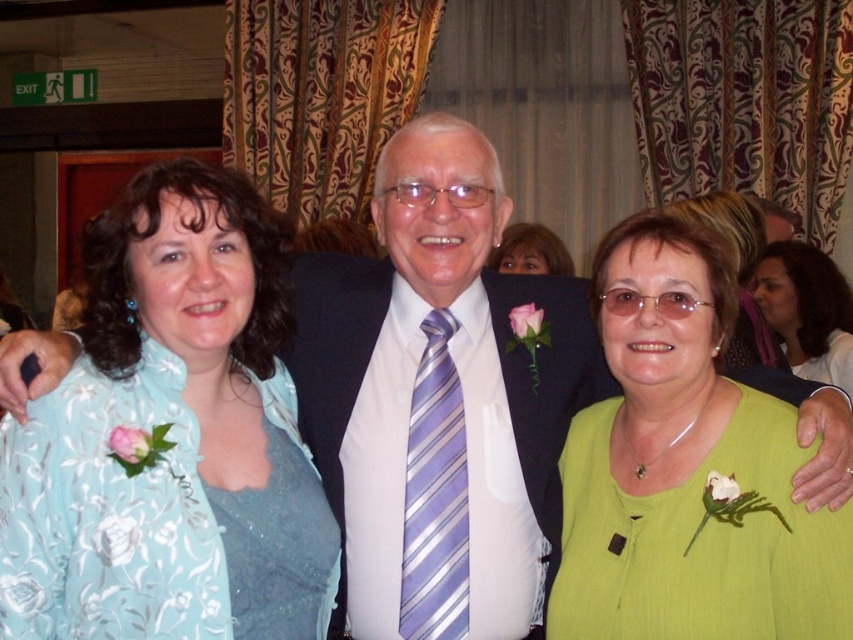
Question: Is light blue floral blouse at center thinner than lavender striped tie at center?

Choices:
 (A) yes
 (B) no

Answer: (B)

Question: Can you confirm if lavender striped tie at center is smaller than matte green dress at center?

Choices:
 (A) no
 (B) yes

Answer: (B)

Question: Which is nearer to the matte green dress at center?

Choices:
 (A) light blue floral blouse at center
 (B) green fabric at center
 (C) matte green dress at lower right

Answer: (C)

Question: Which point is farther to the camera?

Choices:
 (A) light blue floral blouse at center
 (B) lavender striped tie at center
 (C) matte green dress at center
 (D) green fabric at center

Answer: (C)

Question: Estimate the real-world distances between objects in this image. Which object is farther from the matte green dress at center?

Choices:
 (A) matte green dress at lower right
 (B) green fabric at center

Answer: (B)

Question: Is light blue floral blouse at center bigger than matte green dress at center?

Choices:
 (A) yes
 (B) no

Answer: (A)